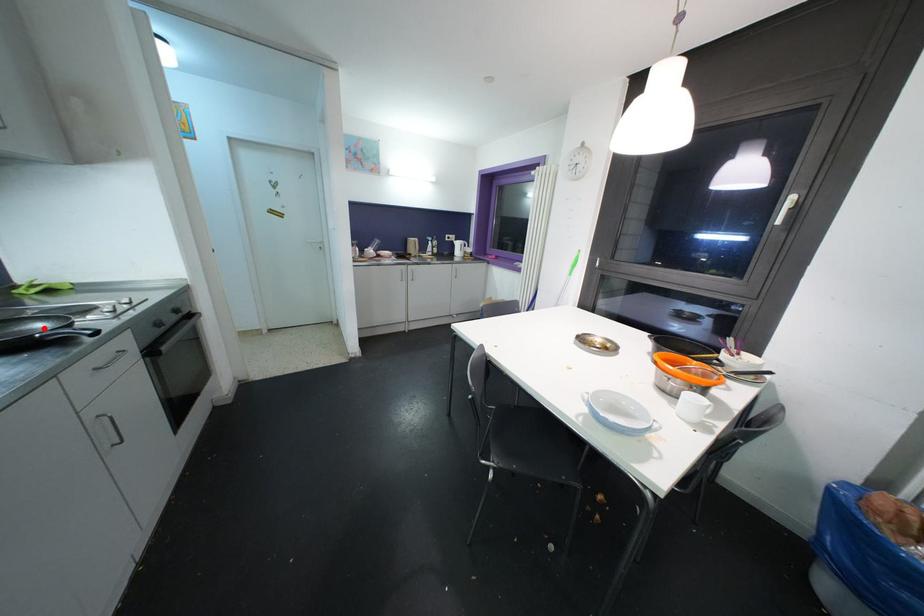
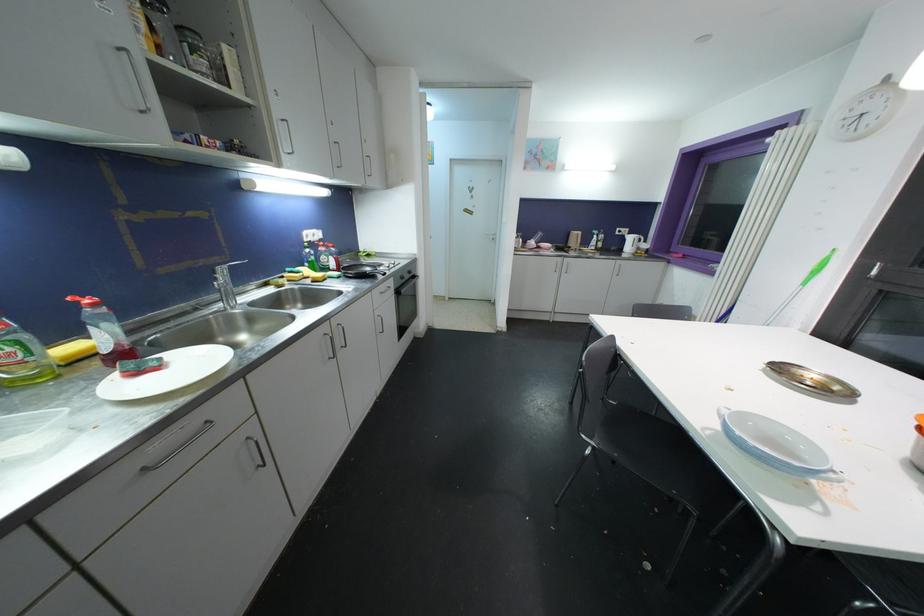
Where in the second image is the point corresponding to the highlighted location from the first image?

(371, 272)